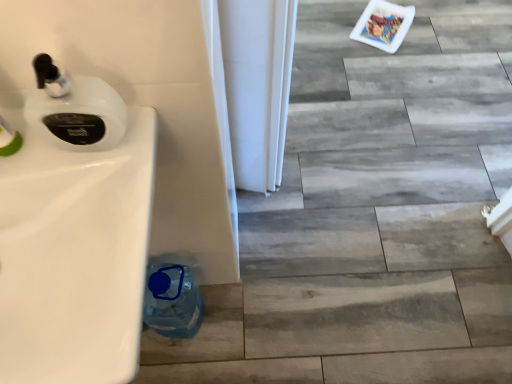
Locate an element on the screen. free spot in front of blue plastic bottle at lower left is located at coordinates (182, 366).